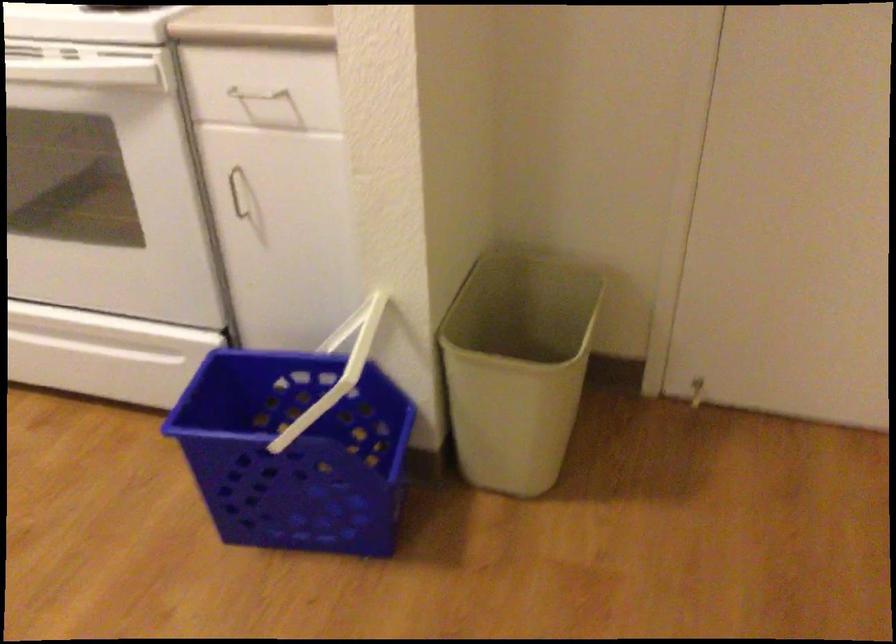
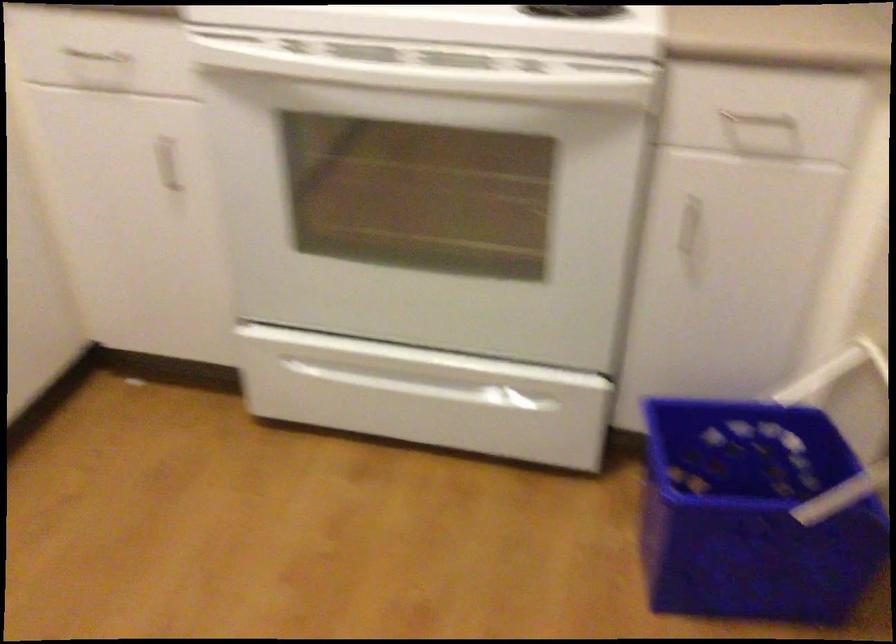
Find the pixel in the second image that matches the point at 251,201 in the first image.

(691, 228)